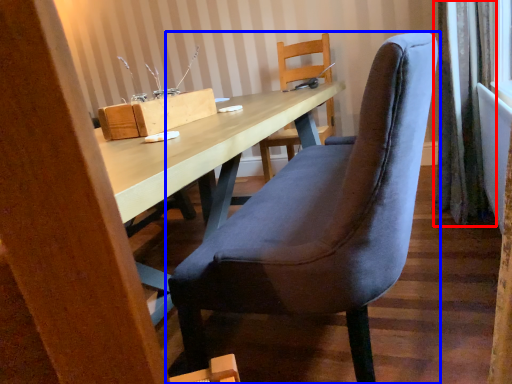
Question: Which of the following is the farthest to the observer, curtain (highlighted by a red box) or chair (highlighted by a blue box)?

Choices:
 (A) curtain
 (B) chair

Answer: (A)